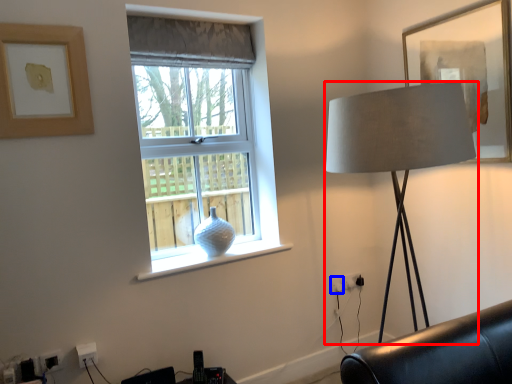
Question: Which object is closer to the camera taking this photo, lamp (highlighted by a red box) or electric outlet (highlighted by a blue box)?

Choices:
 (A) lamp
 (B) electric outlet

Answer: (A)